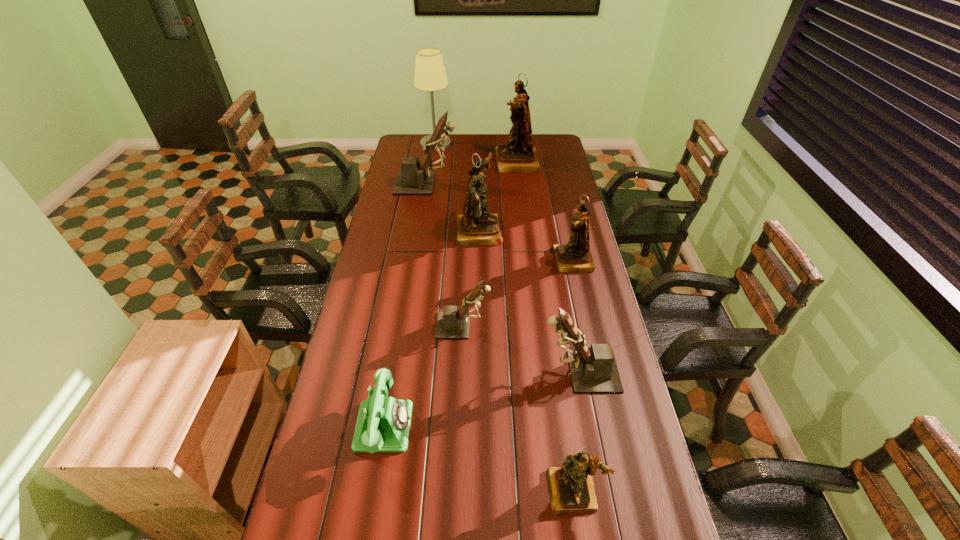
The width and height of the screenshot is (960, 540). I want to click on free spot located on the front-facing side of the farthest brown figurine, so click(474, 184).

Where is `vacant position located on the front-facing side of the third farthest figurine`? Image resolution: width=960 pixels, height=540 pixels. vacant position located on the front-facing side of the third farthest figurine is located at coordinates (x=528, y=230).

The width and height of the screenshot is (960, 540). I want to click on blank area located 0.180m on the front-facing side of the fifth farthest object, so click(x=508, y=261).

The height and width of the screenshot is (540, 960). I want to click on free space located on the front-facing side of the fifth farthest object, so click(492, 261).

At what (x,y) coordinates should I click in order to perform the action: click on free region located 0.100m on the front-facing side of the fifth farthest object. Please return your answer as a coordinate pair (x, y). Looking at the image, I should click on (527, 261).

At what (x,y) coordinates should I click in order to perform the action: click on free space located 0.150m on the front-facing side of the rightmost brown figurine. Please return your answer as a coordinate pair (x, y). The height and width of the screenshot is (540, 960). Looking at the image, I should click on (492, 372).

Locate an element on the screen. This screenshot has height=540, width=960. vacant space situated on the front-facing side of the rightmost brown figurine is located at coordinates (480, 372).

This screenshot has width=960, height=540. Identify the location of vacant point located on the front-facing side of the rightmost brown figurine. (439, 372).

Find the location of a particular element. The height and width of the screenshot is (540, 960). free space located 0.310m on the front-facing side of the smallest brown figurine is located at coordinates (579, 326).

At what (x,y) coordinates should I click in order to perform the action: click on vacant space located 0.050m on the dial of the telephone. Please return your answer as a coordinate pair (x, y). This screenshot has height=540, width=960. Looking at the image, I should click on (429, 426).